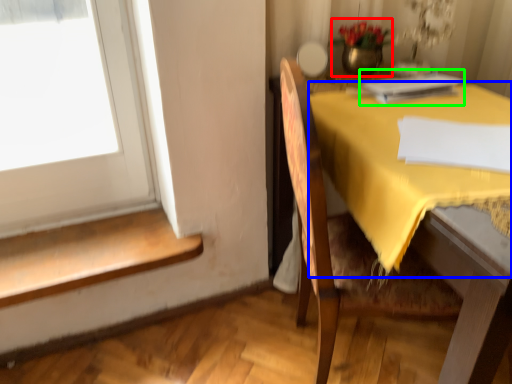
Question: Which object is the closest to the floral arrangement (highlighted by a red box)? Choose among these: tablecloth (highlighted by a blue box) or book (highlighted by a green box).

Choices:
 (A) tablecloth
 (B) book

Answer: (B)